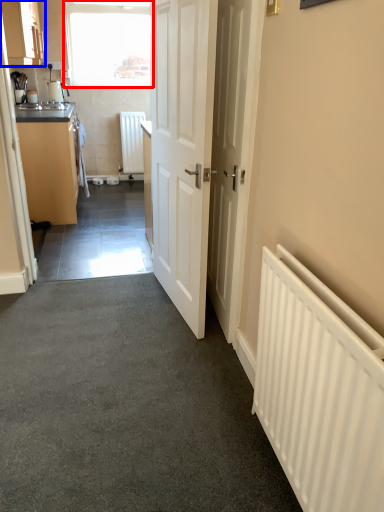
Question: Which point is closer to the camera, window (highlighted by a red box) or cabinetry (highlighted by a blue box)?

Choices:
 (A) window
 (B) cabinetry

Answer: (B)